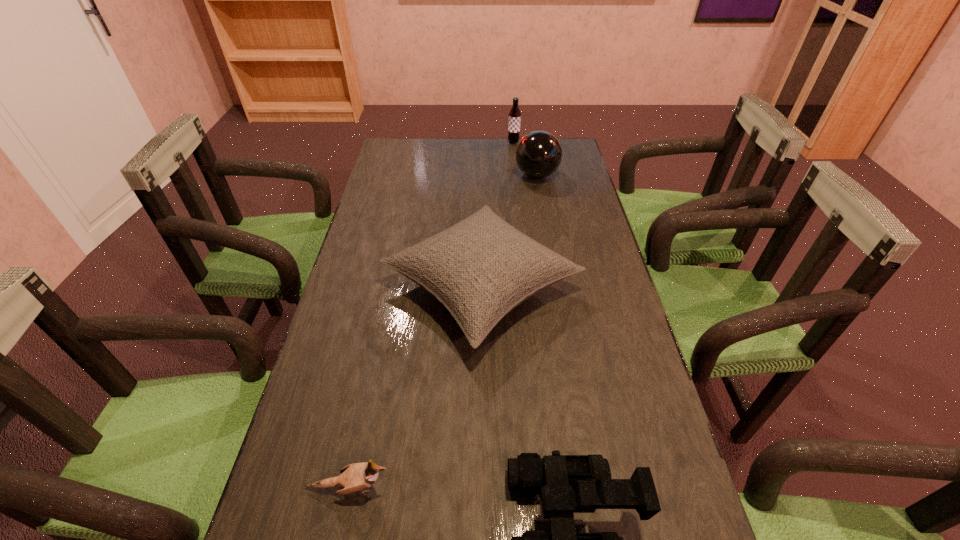
Image resolution: width=960 pixels, height=540 pixels. In order to click on the farthest object in this screenshot , I will do `click(514, 121)`.

Locate an element on the screen. Image resolution: width=960 pixels, height=540 pixels. the second farthest object is located at coordinates click(538, 154).

The image size is (960, 540). I want to click on the third farthest object, so click(x=481, y=268).

Image resolution: width=960 pixels, height=540 pixels. I want to click on bird, so click(x=358, y=477).

This screenshot has width=960, height=540. What are the coordinates of `free space located 0.130m on the front of the root beer` in the screenshot? It's located at (516, 161).

Where is `free location located on the surface of the bowling ball near the finger holes`? This screenshot has height=540, width=960. free location located on the surface of the bowling ball near the finger holes is located at coordinates (442, 175).

This screenshot has width=960, height=540. In order to click on vacant space located on the surface of the bowling ball near the finger holes in this screenshot , I will do `click(461, 175)`.

Where is `vacant region located 0.260m on the surface of the bowling ball near the finger holes`? vacant region located 0.260m on the surface of the bowling ball near the finger holes is located at coordinates (444, 175).

Where is `free space located on the front of the cushion`? The height and width of the screenshot is (540, 960). free space located on the front of the cushion is located at coordinates (482, 539).

Where is `free space located at the face of the bird`? The image size is (960, 540). free space located at the face of the bird is located at coordinates (566, 488).